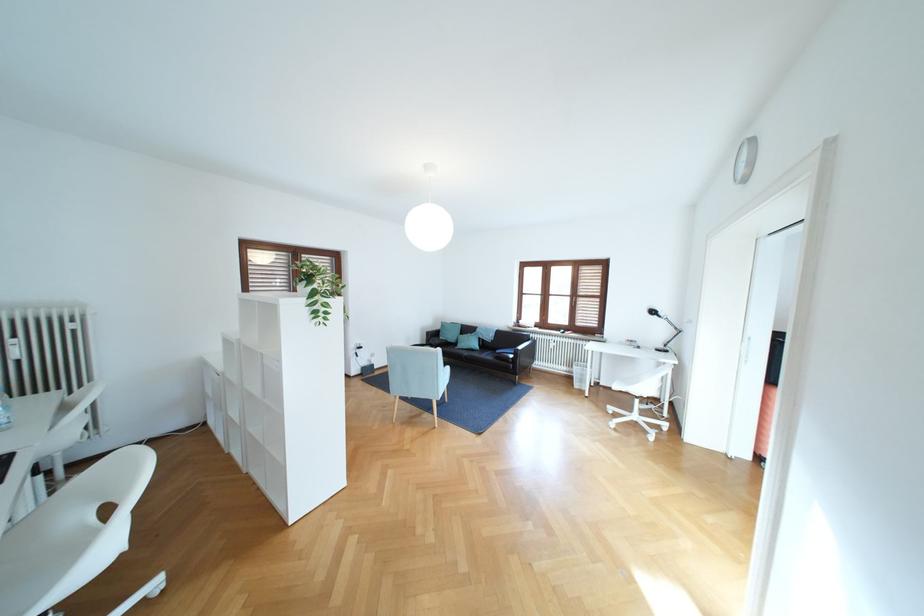
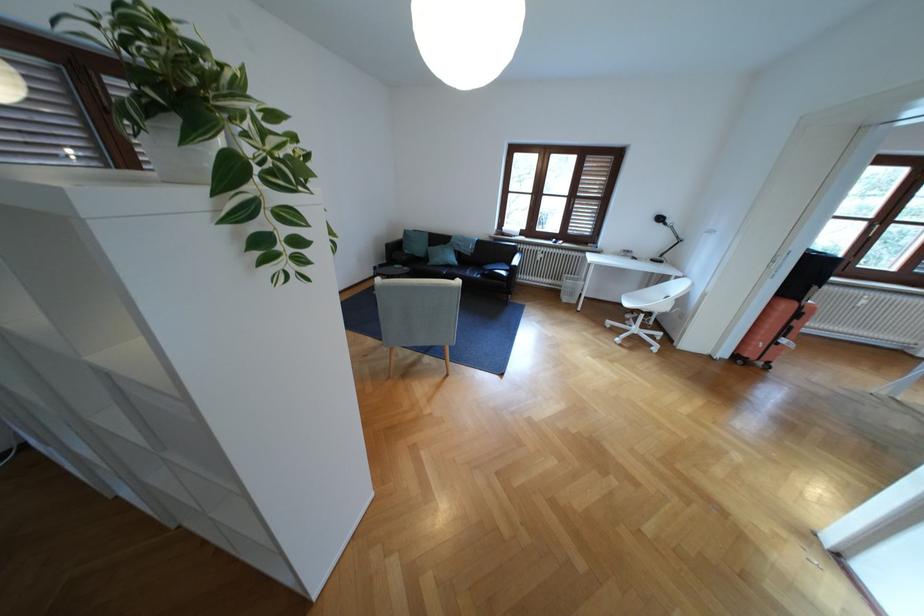
Consider the image. The images are taken continuously from a first-person perspective. In which direction are you moving?

The cameraman walked toward left, forward.